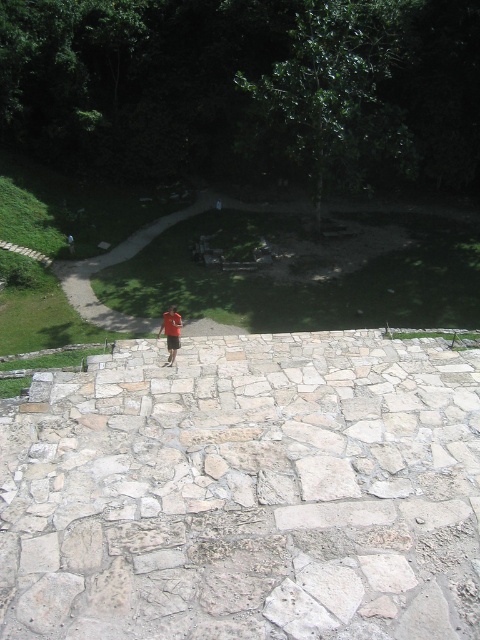
This screenshot has height=640, width=480. Describe the element at coordinates (245, 492) in the screenshot. I see `natural stone at center` at that location.

Is point (276, 353) positioned after point (168, 332)?

Yes, point (276, 353) is farther from viewer.

Where is `natural stone at center`? This screenshot has height=640, width=480. natural stone at center is located at coordinates (245, 492).

Is point (40, 472) more distant than point (200, 209)?

No, it is in front of (200, 209).

Who is taller, natural stone at center or green grass at lower left?

Standing taller between the two is green grass at lower left.

Which is behind, point (194, 412) or point (153, 225)?

The point (153, 225) is more distant.

This screenshot has width=480, height=640. Find the location of `natural stone at center`. natural stone at center is located at coordinates (245, 492).

Is green grass at lower left thinner than red fabric shorts at center?

Incorrect, green grass at lower left's width is not less than red fabric shorts at center's.

What do you see at coordinates (117, 262) in the screenshot?
I see `green grass at lower left` at bounding box center [117, 262].

Describe the element at coordinates (117, 262) in the screenshot. I see `green grass at lower left` at that location.

Locate an element on the screen. This screenshot has height=640, width=480. green grass at lower left is located at coordinates (117, 262).